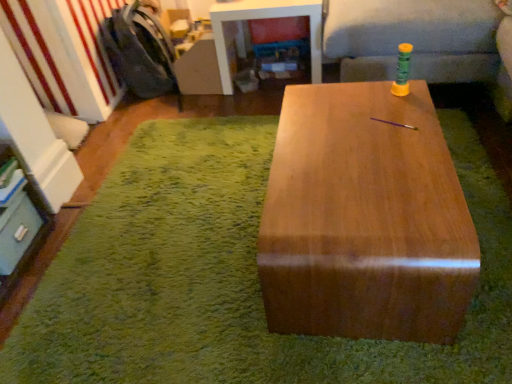
This screenshot has height=384, width=512. Identify the location of vacant space situated above wooden table at center (from a real-world perspective). (213, 230).